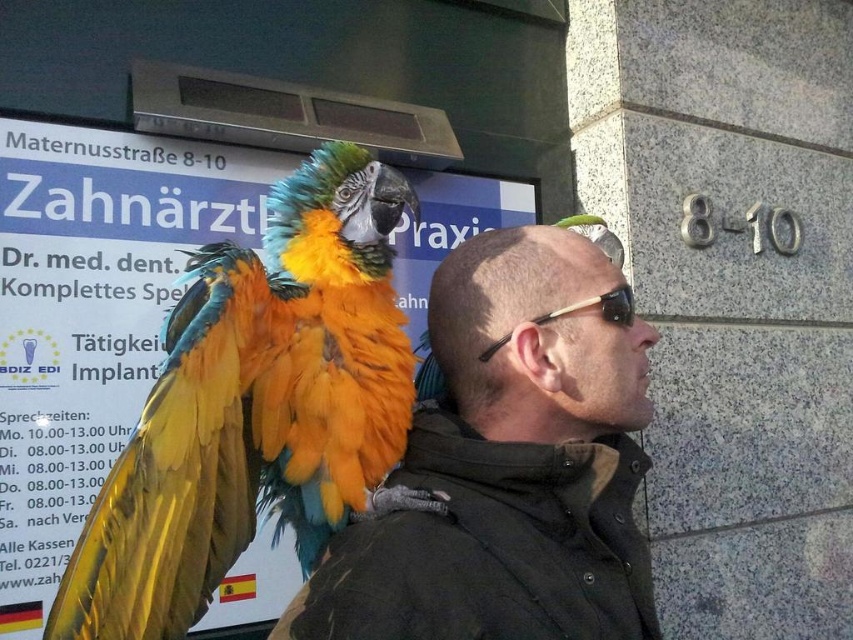
Question: Which object appears closest to the camera in this image?

Choices:
 (A) shiny multicolored parrot at center
 (B) matte black jacket at center
 (C) black acetate sunglasses at upper center

Answer: (B)

Question: Can you confirm if matte black jacket at center is positioned to the right of black acetate sunglasses at upper center?

Choices:
 (A) yes
 (B) no

Answer: (B)

Question: Which point is closer to the camera?

Choices:
 (A) (351, 148)
 (B) (508, 355)

Answer: (B)

Question: Is matte black jacket at center in front of black acetate sunglasses at upper center?

Choices:
 (A) yes
 (B) no

Answer: (A)

Question: Considering the real-world distances, which object is closest to the shiny black sunglasses at center?

Choices:
 (A) black acetate sunglasses at upper center
 (B) matte black jacket at center
 (C) shiny multicolored parrot at center

Answer: (B)

Question: Is shiny multicolored parrot at center wider than matte black jacket at center?

Choices:
 (A) yes
 (B) no

Answer: (B)